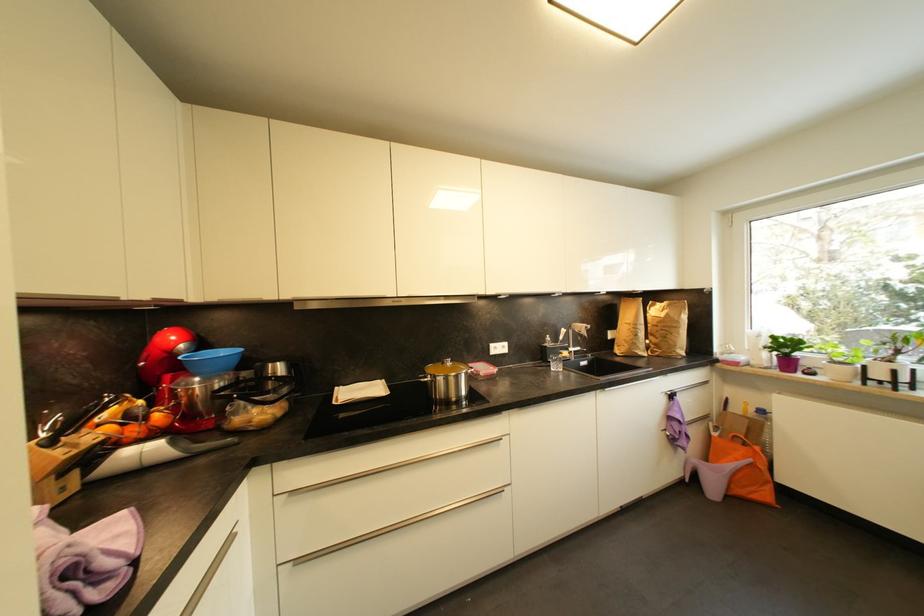
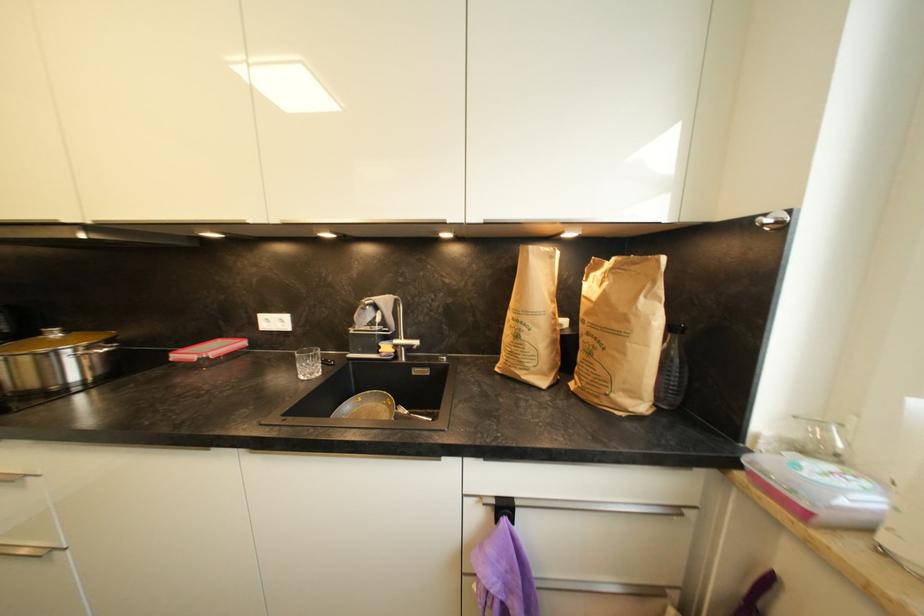
The images are taken continuously from a first-person perspective. In which direction are you moving?

The cameraman moved toward right, forward.